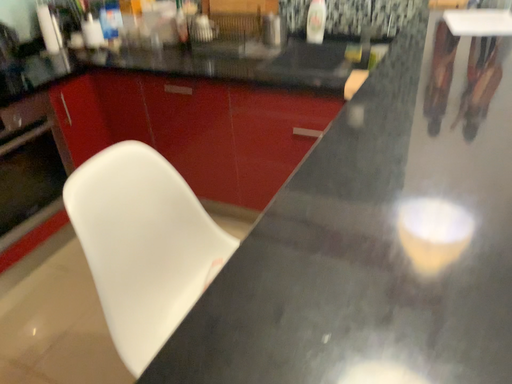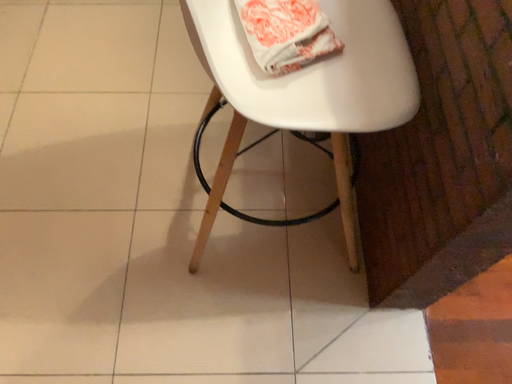
Question: How did the camera likely rotate when shooting the video?

Choices:
 (A) rotated upward
 (B) rotated downward

Answer: (B)